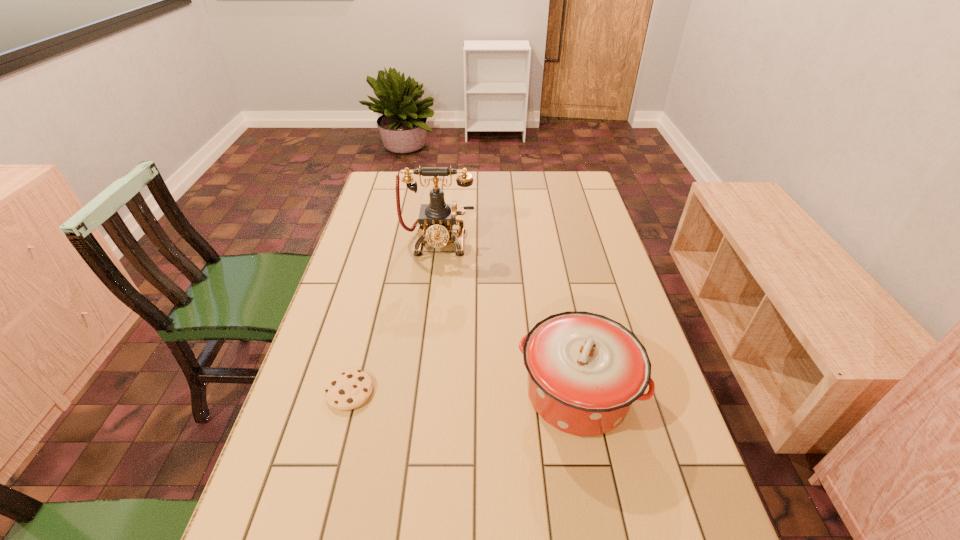
I want to click on free space at the far edge, so click(x=468, y=197).

In the image, there is a desktop. What are the coordinates of `vacant space at the left edge` in the screenshot? It's located at (314, 433).

The height and width of the screenshot is (540, 960). In the image, there is a desktop. Find the location of `free space at the right edge`. free space at the right edge is located at coordinates tap(594, 276).

Identify the location of free space at the far right corner of the desktop. The height and width of the screenshot is (540, 960). [576, 177].

In order to click on vacant space that's between the tallest object and the cookie in this screenshot , I will do `click(394, 317)`.

Identify the location of empty space that is in between the tallest object and the casserole. [x=508, y=318].

Identify the location of empty space that is in between the second tallest object and the telephone. The image size is (960, 540). (508, 318).

What are the coordinates of `free area in between the shortest object and the casserole` in the screenshot? It's located at (464, 393).

You are a GUI agent. You are given a task and a screenshot of the screen. Output one action in this format:
    pyautogui.click(x=<x>, y=<y>)
    Task: Click on the free space between the farthest object and the shortest object
    
    Given the screenshot: What is the action you would take?
    pyautogui.click(x=394, y=317)

At what (x,y) coordinates should I click in order to perform the action: click on vacant space in between the shortest object and the rightmost object. Please return your answer as a coordinate pair (x, y). This screenshot has height=540, width=960. Looking at the image, I should click on (464, 393).